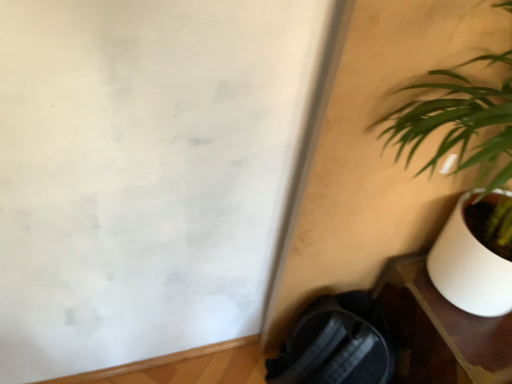
Question: Does green leafy plant at right appear on the left side of white glossy table at lower right?

Choices:
 (A) yes
 (B) no

Answer: (A)

Question: Is green leafy plant at right located outside white glossy table at lower right?

Choices:
 (A) yes
 (B) no

Answer: (A)

Question: Does green leafy plant at right come behind white glossy table at lower right?

Choices:
 (A) no
 (B) yes

Answer: (A)

Question: From a real-world perspective, does green leafy plant at right sit lower than white glossy table at lower right?

Choices:
 (A) yes
 (B) no

Answer: (B)

Question: Does green leafy plant at right have a greater height compared to white glossy table at lower right?

Choices:
 (A) yes
 (B) no

Answer: (A)

Question: Does green leafy plant at right have a lesser width compared to white glossy table at lower right?

Choices:
 (A) no
 (B) yes

Answer: (B)

Question: From a real-world perspective, is white glossy table at lower right over green leafy plant at right?

Choices:
 (A) no
 (B) yes

Answer: (A)

Question: Is white glossy table at lower right wider than green leafy plant at right?

Choices:
 (A) yes
 (B) no

Answer: (A)

Question: Is white glossy table at lower right not close to green leafy plant at right?

Choices:
 (A) no
 (B) yes

Answer: (A)

Question: Is white glossy table at lower right to the left of green leafy plant at right from the viewer's perspective?

Choices:
 (A) no
 (B) yes

Answer: (A)

Question: From the image's perspective, is white glossy table at lower right on green leafy plant at right?

Choices:
 (A) no
 (B) yes

Answer: (A)

Question: Considering the relative sizes of white glossy table at lower right and green leafy plant at right in the image provided, is white glossy table at lower right taller than green leafy plant at right?

Choices:
 (A) yes
 (B) no

Answer: (B)

Question: Is point (459, 117) closer or farther from the camera than point (475, 372)?

Choices:
 (A) closer
 (B) farther

Answer: (A)